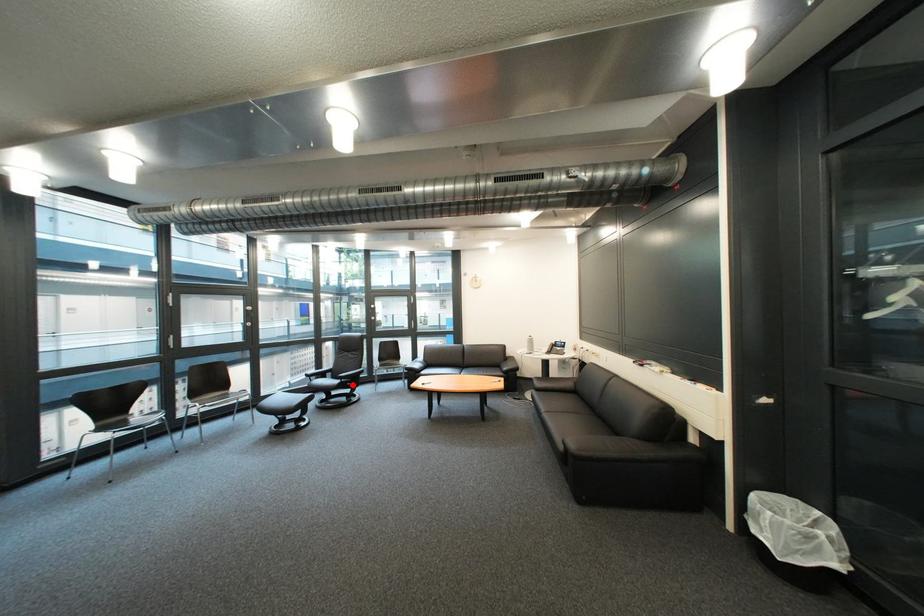
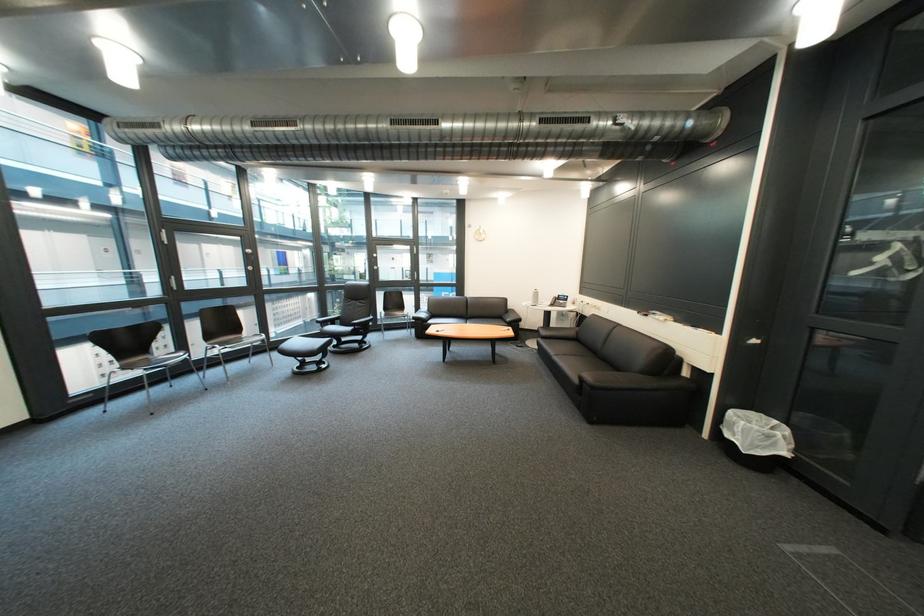
Locate, in the second image, the point that corresponds to the highlighted location in the first image.

(366, 331)